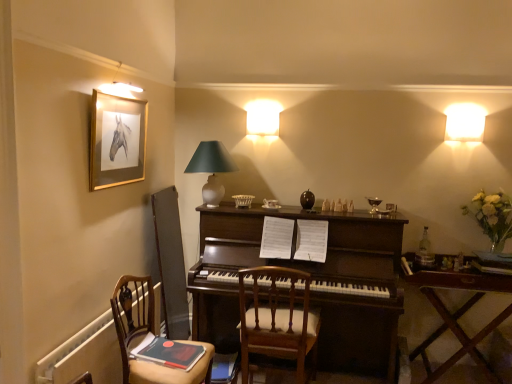
Find the location of a particular element. free point above white frosted glass lampshade at upper right (from a real-world perspective) is located at coordinates (466, 117).